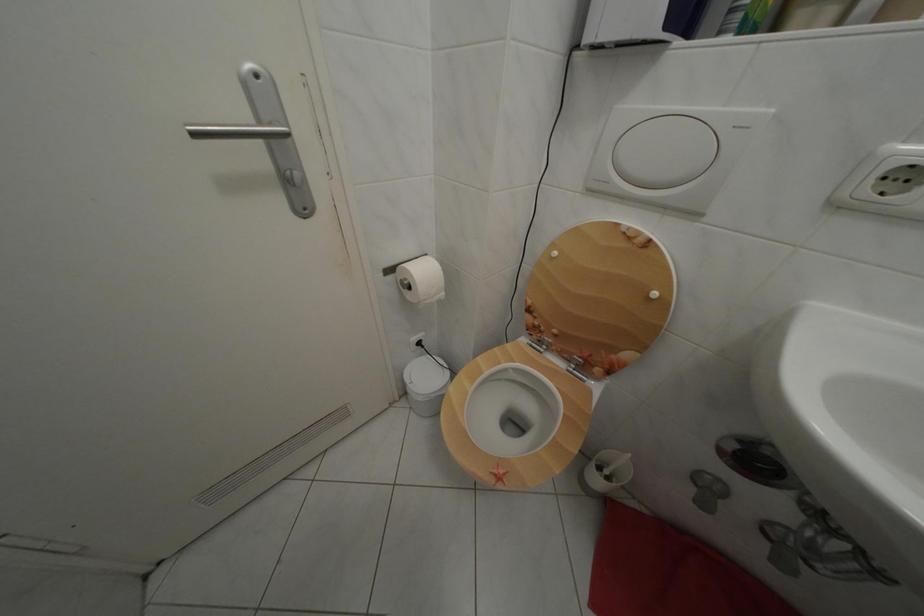
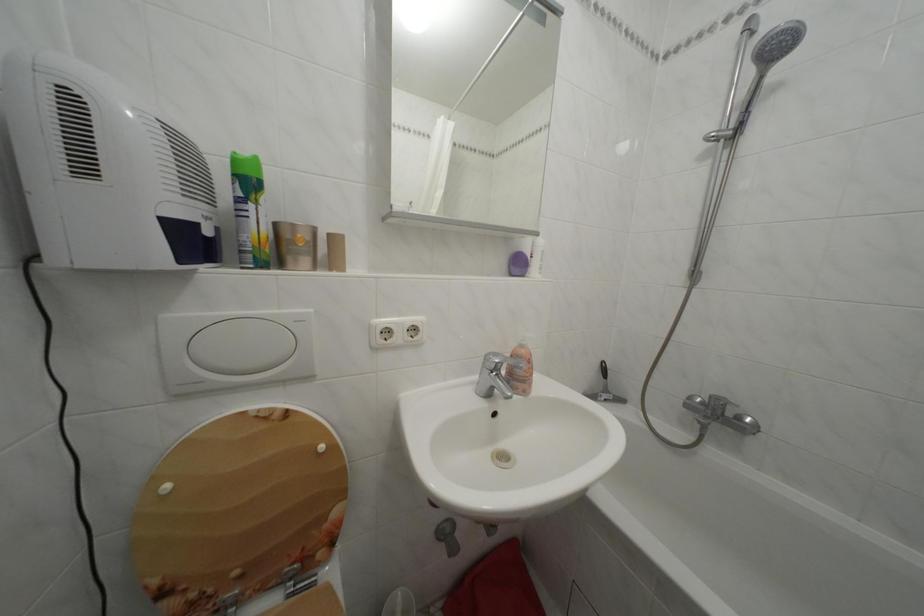
Question: Based on the continuous images, in which direction is the camera rotating? Reply with the corresponding letter.

Choices:
 (A) Left
 (B) Right
 (C) Up
 (D) Down

Answer: (B)